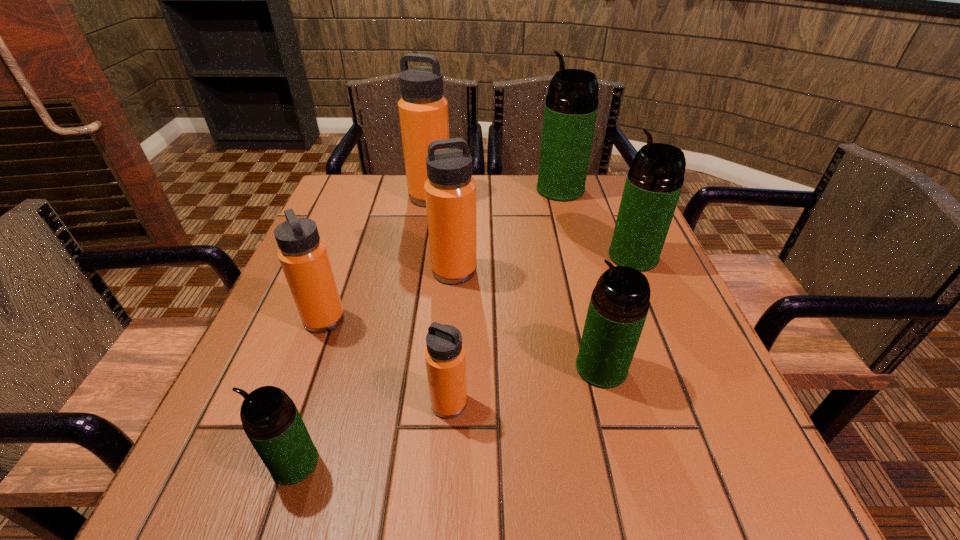
Identify the location of free space at the near edge of the desktop. This screenshot has height=540, width=960. (536, 485).

In the image, there is a desktop. Identify the location of vacant space at the left edge. This screenshot has width=960, height=540. (228, 448).

Locate an element on the screen. vacant space at the right edge of the desktop is located at coordinates (668, 377).

In the image, there is a desktop. Where is `vacant space at the far left corner`? This screenshot has height=540, width=960. vacant space at the far left corner is located at coordinates (363, 193).

In the image, there is a desktop. Where is `vacant space at the far right corner`? This screenshot has height=540, width=960. vacant space at the far right corner is located at coordinates (621, 176).

In the image, there is a desktop. Identify the location of blank space at the near right corner. The height and width of the screenshot is (540, 960). (777, 502).

Where is `free space that is in between the leftmost orange thermos bottle and the third biggest green thermos bottle`? free space that is in between the leftmost orange thermos bottle and the third biggest green thermos bottle is located at coordinates (463, 343).

Where is `free space between the farthest green thermos bottle and the second biggest green thermos bottle`? free space between the farthest green thermos bottle and the second biggest green thermos bottle is located at coordinates (597, 223).

You are a GUI agent. You are given a task and a screenshot of the screen. Output one action in this format:
    pyautogui.click(x=<x>, y=<y>)
    Task: Click on the vacant space in between the farthest orange thermos bottle and the third biggest orange thermos bottle
    The image size is (960, 540).
    Given the screenshot: What is the action you would take?
    pyautogui.click(x=377, y=258)

Identify the location of vacant area that lies between the nearest green thermos bottle and the biggest orange thermos bottle. (363, 329).